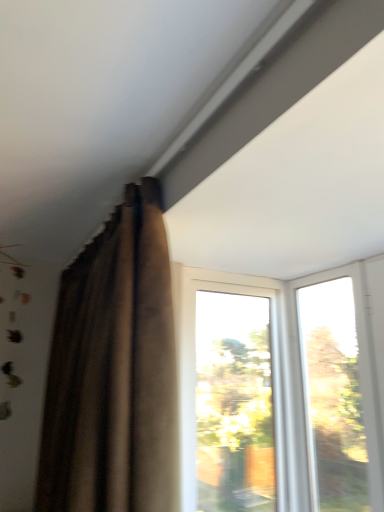
Question: Considering their positions, is transparent glass window at center, placed as the 2th window when sorted from right to left, located in front of or behind transparent glass window at upper right, which appears as the second window when viewed from the left?

Choices:
 (A) behind
 (B) front

Answer: (A)

Question: Considering the relative positions of transparent glass window at center, placed as the 2th window when sorted from right to left, and transparent glass window at upper right, which appears as the second window when viewed from the left, in the image provided, is transparent glass window at center, placed as the 2th window when sorted from right to left, to the left or to the right of transparent glass window at upper right, which appears as the second window when viewed from the left,?

Choices:
 (A) right
 (B) left

Answer: (B)

Question: Estimate the real-world distances between objects in this image. Which object is closer to the brown velvet curtain at upper left?

Choices:
 (A) transparent glass window at center, which appears as the first window when viewed from the left
 (B) transparent glass window at upper right, which appears as the second window when viewed from the left

Answer: (A)

Question: Which object is the closest to the brown velvet curtain at upper left?

Choices:
 (A) transparent glass window at center, placed as the 2th window when sorted from right to left
 (B) transparent glass window at upper right, which appears as the second window when viewed from the left

Answer: (A)